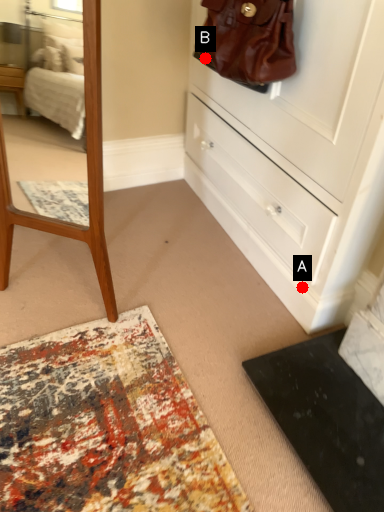
Question: Two points are circled on the image, labeled by A and B beside each circle. Which point is closer to the camera?

Choices:
 (A) A is closer
 (B) B is closer

Answer: (B)